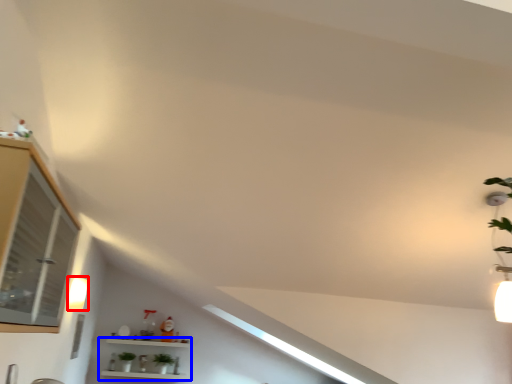
Question: Which object is closer to the camera taking this photo, light fixture (highlighted by a red box) or shelf (highlighted by a blue box)?

Choices:
 (A) light fixture
 (B) shelf

Answer: (A)